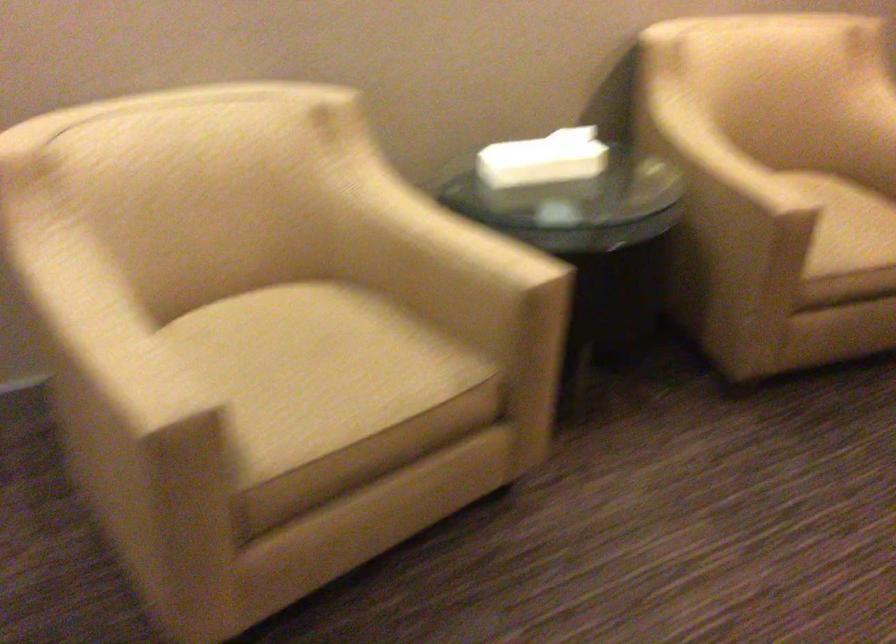
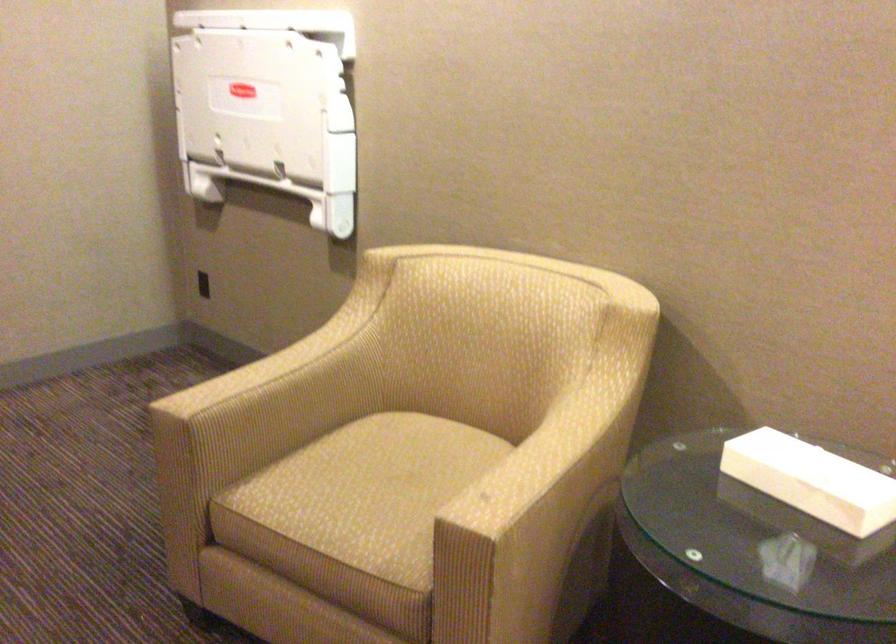
Find the pixel in the second image that matches point 566,158 in the first image.

(812, 480)